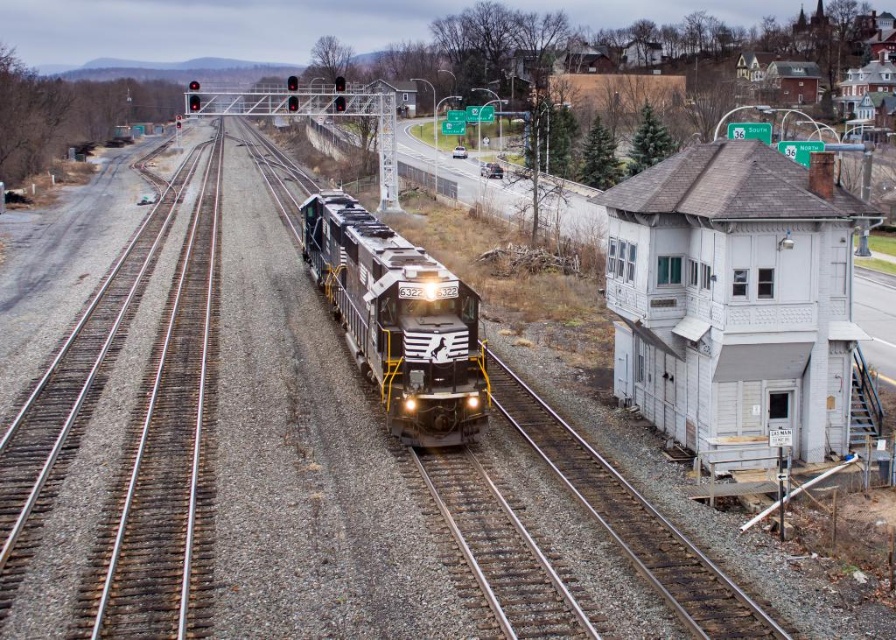
You are a maintenance worker standing on the platform next to the smooth steel tracks at center. You need to inspect the black textured locomotive at center that is 6.31 meters away. What is the minimum distance you must walk to reach the locomotive?

You must walk at least 6.31 meters to reach the black textured locomotive at center from the smooth steel tracks at center.

You are standing at the entrance of the signal tower and want to reach the tracks. According to the coordinates provided, in which direction should you walk to reach the smooth steel tracks at center?

The smooth steel tracks at center are located at coordinates point [289,458]. Since you are at the entrance of the signal tower, you should walk towards the coordinates to reach the tracks.

You are standing at the point labeled point (x=62, y=570) and want to walk to the point labeled point (x=696, y=45). Which direction should you face to walk towards the point?

You should face towards the lower right direction to walk towards point (x=696, y=45) from point (x=62, y=570).